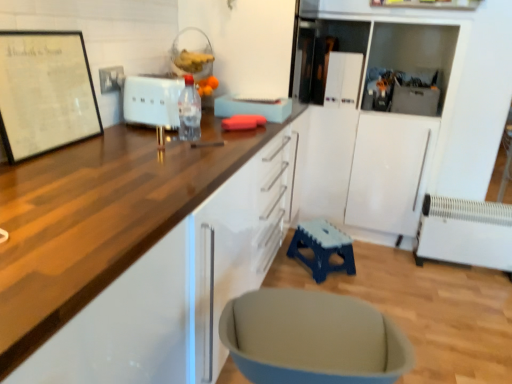
The width and height of the screenshot is (512, 384). What are the coordinates of `vacant region in front of white plastic radiator at lower right` in the screenshot? It's located at (473, 298).